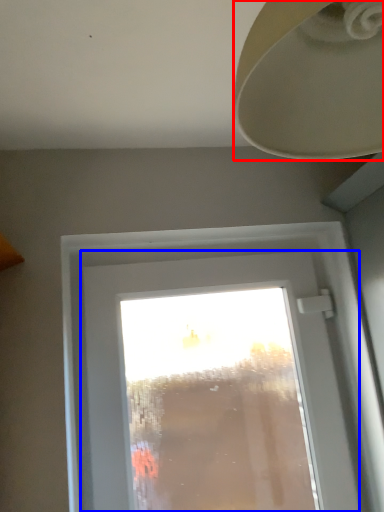
Question: Which object appears closest to the camera in this image, lamp (highlighted by a red box) or window (highlighted by a blue box)?

Choices:
 (A) lamp
 (B) window

Answer: (A)